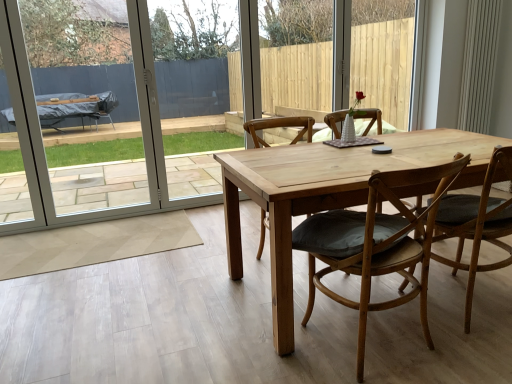
Question: Is wooden chair with cushion at center, the second chair from the right, to the right of light brown wooden chair at center, arranged as the third chair when viewed from the left, from the viewer's perspective?

Choices:
 (A) no
 (B) yes

Answer: (A)

Question: Is wooden chair with cushion at center, the second chair from the right, shorter than light brown wooden chair at center, which is counted as the 1th chair, starting from the right?

Choices:
 (A) yes
 (B) no

Answer: (A)

Question: Is light brown wooden chair at center, which is counted as the 1th chair, starting from the right, at the back of wooden chair with cushion at center, the second chair from the right?

Choices:
 (A) yes
 (B) no

Answer: (B)

Question: Does wooden chair with cushion at center, placed as the 2th chair when sorted from left to right, have a smaller size compared to light brown wooden chair at center, arranged as the third chair when viewed from the left?

Choices:
 (A) no
 (B) yes

Answer: (A)

Question: From the image's perspective, is wooden chair with cushion at center, the second chair from the right, on light brown wooden chair at center, arranged as the third chair when viewed from the left?

Choices:
 (A) yes
 (B) no

Answer: (B)

Question: Considering the relative sizes of wooden chair with cushion at center, placed as the 2th chair when sorted from left to right, and light brown wooden chair at center, arranged as the third chair when viewed from the left, in the image provided, is wooden chair with cushion at center, placed as the 2th chair when sorted from left to right, bigger than light brown wooden chair at center, arranged as the third chair when viewed from the left,?

Choices:
 (A) no
 (B) yes

Answer: (B)

Question: Considering the relative sizes of white plastic screen door at left and light brown wooden chair at center, arranged as the third chair when viewed from the left, in the image provided, is white plastic screen door at left taller than light brown wooden chair at center, arranged as the third chair when viewed from the left,?

Choices:
 (A) no
 (B) yes

Answer: (B)

Question: Does white plastic screen door at left have a lesser width compared to light brown wooden chair at center, arranged as the third chair when viewed from the left?

Choices:
 (A) no
 (B) yes

Answer: (B)

Question: Does white plastic screen door at left have a greater width compared to light brown wooden chair at center, arranged as the third chair when viewed from the left?

Choices:
 (A) yes
 (B) no

Answer: (B)

Question: Is white plastic screen door at left in contact with light brown wooden chair at center, which is counted as the 1th chair, starting from the right?

Choices:
 (A) no
 (B) yes

Answer: (A)

Question: Is white plastic screen door at left completely or partially outside of light brown wooden chair at center, arranged as the third chair when viewed from the left?

Choices:
 (A) yes
 (B) no

Answer: (A)

Question: From a real-world perspective, is white plastic screen door at left located beneath light brown wooden chair at center, which is counted as the 1th chair, starting from the right?

Choices:
 (A) yes
 (B) no

Answer: (B)

Question: Can we say light brown wooden chair at center, placed as the third chair when sorted from right to left, lies outside wooden chair with cushion at center, the second chair from the right?

Choices:
 (A) no
 (B) yes

Answer: (B)